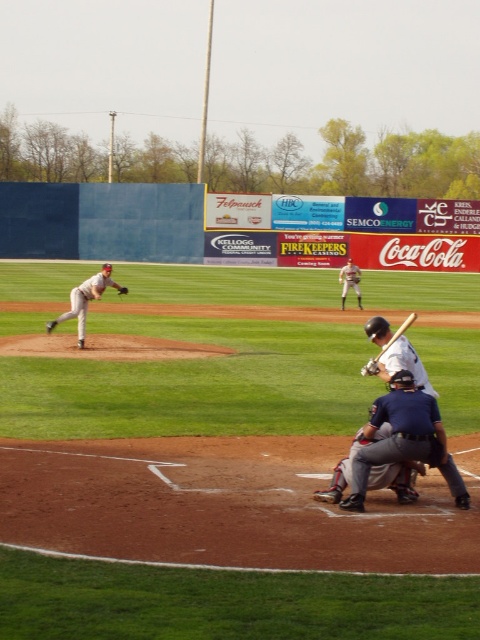
Does dark blue uniform at lower center appear on the left side of gray uniformed pitcher at left?

Incorrect, dark blue uniform at lower center is not on the left side of gray uniformed pitcher at left.

Consider the image. Does dark blue uniform at lower center have a larger size compared to gray uniformed pitcher at left?

Actually, dark blue uniform at lower center might be smaller than gray uniformed pitcher at left.

Identify the location of dark blue uniform at lower center. (404, 440).

The width and height of the screenshot is (480, 640). In order to click on dark blue uniform at lower center in this screenshot , I will do `click(404, 440)`.

The height and width of the screenshot is (640, 480). What are the coordinates of `wooden bat at lower center` in the screenshot? It's located at (387, 346).

Does wooden bat at lower center have a lesser height compared to brown leather glove at center?

No.

Is point (395, 339) closer to viewer compared to point (119, 288)?

Yes, point (395, 339) is in front of point (119, 288).

The height and width of the screenshot is (640, 480). I want to click on wooden bat at lower center, so click(x=387, y=346).

Can you confirm if dark blue uniform at lower center is shorter than gray fabric catcher at lower center?

Incorrect, dark blue uniform at lower center's height does not fall short of gray fabric catcher at lower center's.

Between dark blue uniform at lower center and gray fabric catcher at lower center, which one has more height?

With more height is dark blue uniform at lower center.

Who is more forward, (360, 474) or (415, 493)?

Point (360, 474)

The height and width of the screenshot is (640, 480). Find the location of `dark blue uniform at lower center`. dark blue uniform at lower center is located at coordinates (404, 440).